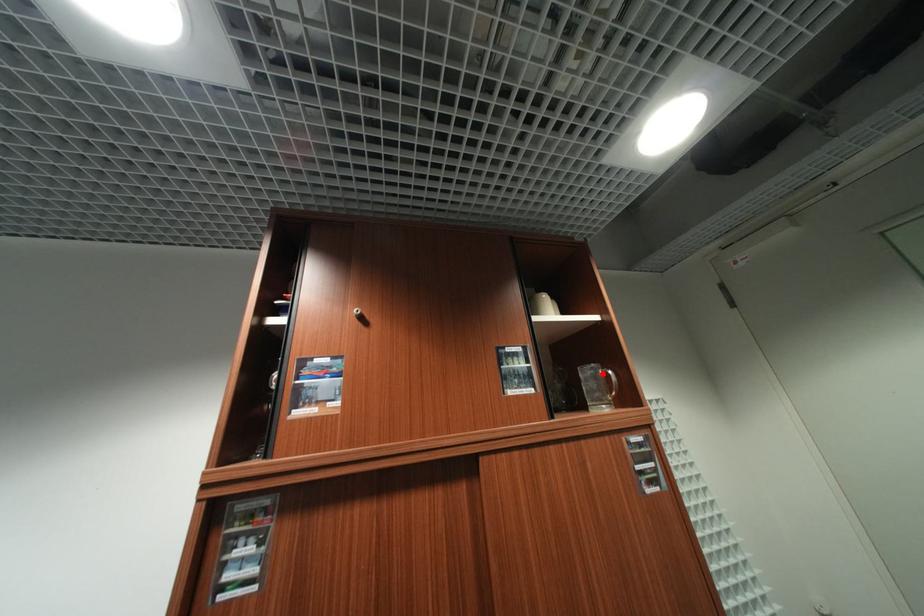
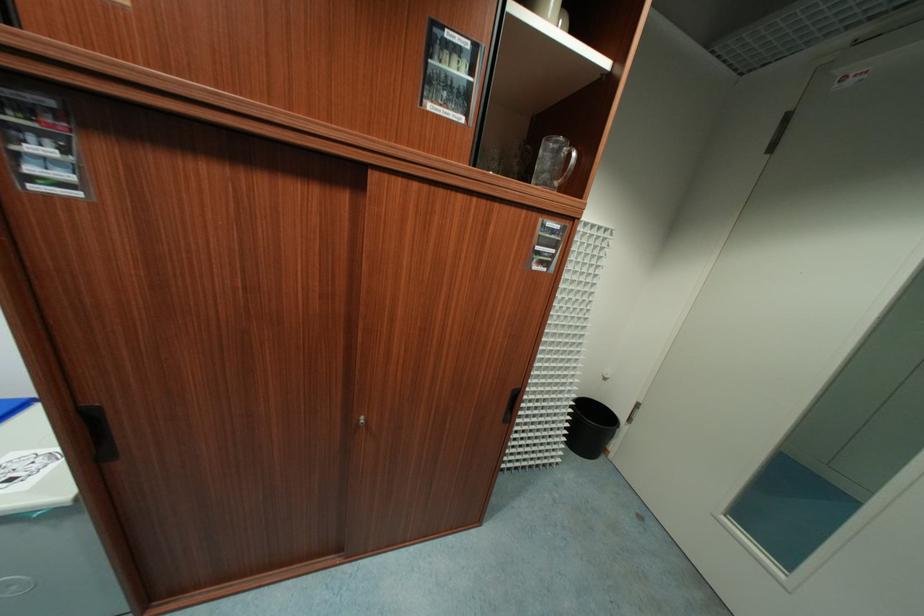
In the second image, find the point that corresponds to the highlighted location in the first image.

(565, 151)